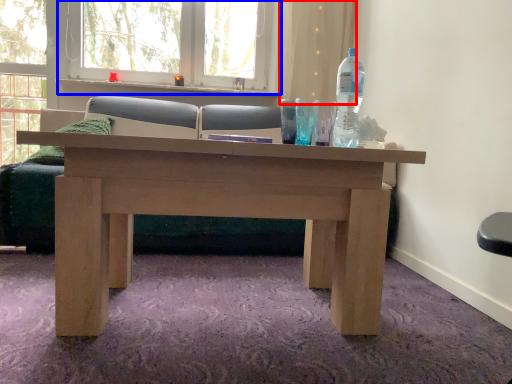
Question: Among these objects, which one is nearest to the camera, curtain (highlighted by a red box) or window frame (highlighted by a blue box)?

Choices:
 (A) curtain
 (B) window frame

Answer: (B)